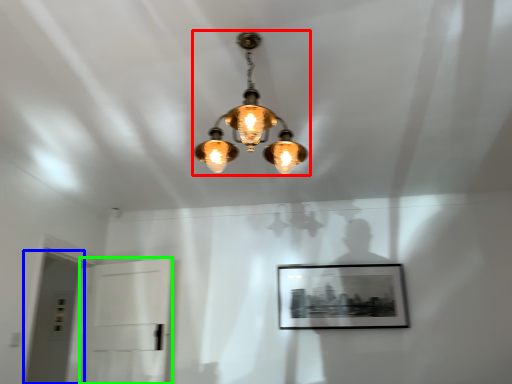
Question: Which is nearer to the lamp (highlighted by a red box)? glass door (highlighted by a blue box) or glass door (highlighted by a green box).

Choices:
 (A) glass door
 (B) glass door

Answer: (B)